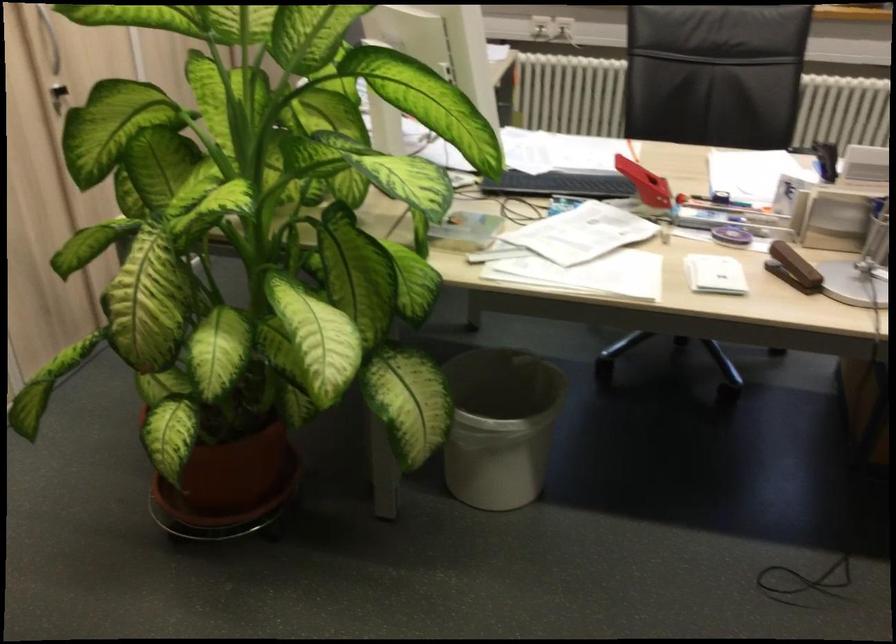
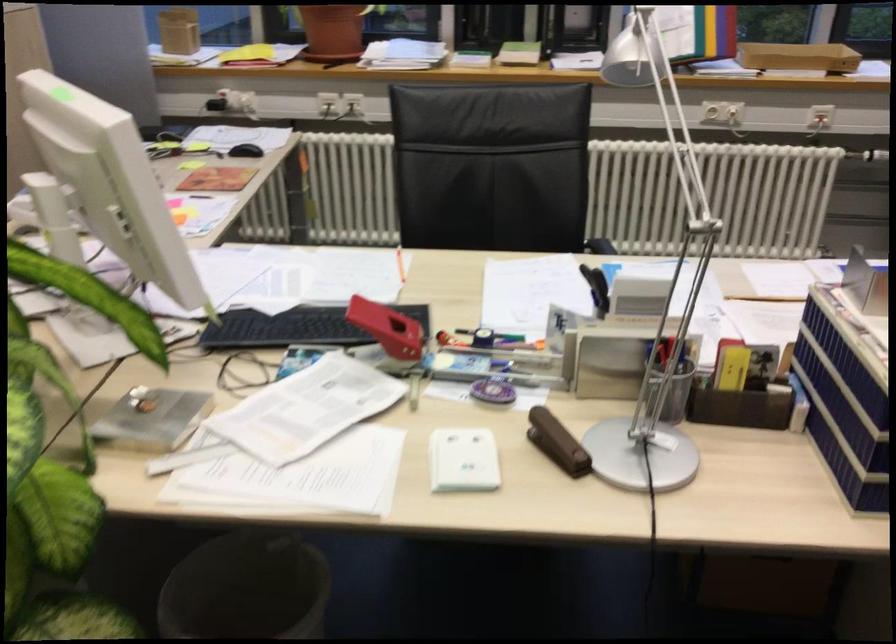
Find the pixel in the second image that matches [674,154] in the first image.

(453, 265)